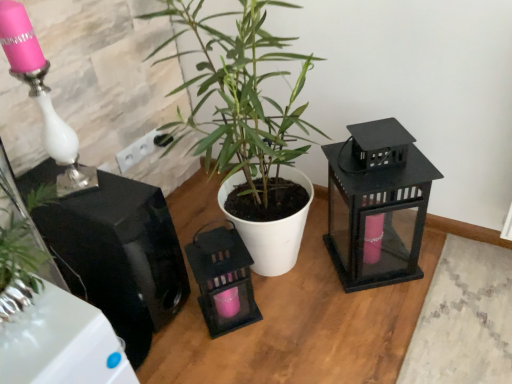
Question: Is white plastic electric outlet at upper center positioned behind matte black lantern at right, acting as the first appliance starting from the right?

Choices:
 (A) yes
 (B) no

Answer: (A)

Question: From a real-world perspective, is white plastic electric outlet at upper center positioned over matte black lantern at right, acting as the 2th appliance starting from the left, based on gravity?

Choices:
 (A) no
 (B) yes

Answer: (B)

Question: Is white plastic electric outlet at upper center bigger than matte black lantern at right, acting as the first appliance starting from the right?

Choices:
 (A) no
 (B) yes

Answer: (A)

Question: Are white plastic electric outlet at upper center and matte black lantern at right, acting as the 2th appliance starting from the left, located far from each other?

Choices:
 (A) yes
 (B) no

Answer: (B)

Question: Can you confirm if white plastic electric outlet at upper center is shorter than matte black lantern at right, acting as the 2th appliance starting from the left?

Choices:
 (A) yes
 (B) no

Answer: (A)

Question: From a real-world perspective, is white plastic electric outlet at upper center beneath matte black lantern at right, acting as the first appliance starting from the right?

Choices:
 (A) no
 (B) yes

Answer: (A)

Question: Can you confirm if green matte plant at center is smaller than glossy black speaker at left, which is the 1th appliance in left-to-right order?

Choices:
 (A) yes
 (B) no

Answer: (B)

Question: Is green matte plant at center thinner than glossy black speaker at left, which ranks as the 2th appliance in right-to-left order?

Choices:
 (A) yes
 (B) no

Answer: (B)

Question: Does green matte plant at center appear on the left side of glossy black speaker at left, which is the 1th appliance in left-to-right order?

Choices:
 (A) yes
 (B) no

Answer: (B)

Question: Is green matte plant at center bigger than glossy black speaker at left, which ranks as the 2th appliance in right-to-left order?

Choices:
 (A) no
 (B) yes

Answer: (B)

Question: Is green matte plant at center not near glossy black speaker at left, which ranks as the 2th appliance in right-to-left order?

Choices:
 (A) no
 (B) yes

Answer: (A)

Question: Does green matte plant at center appear on the right side of glossy black speaker at left, which ranks as the 2th appliance in right-to-left order?

Choices:
 (A) no
 (B) yes

Answer: (B)

Question: Is glossy black speaker at left, which ranks as the 2th appliance in right-to-left order, turned away from matte black lantern at right, acting as the first appliance starting from the right?

Choices:
 (A) no
 (B) yes

Answer: (A)